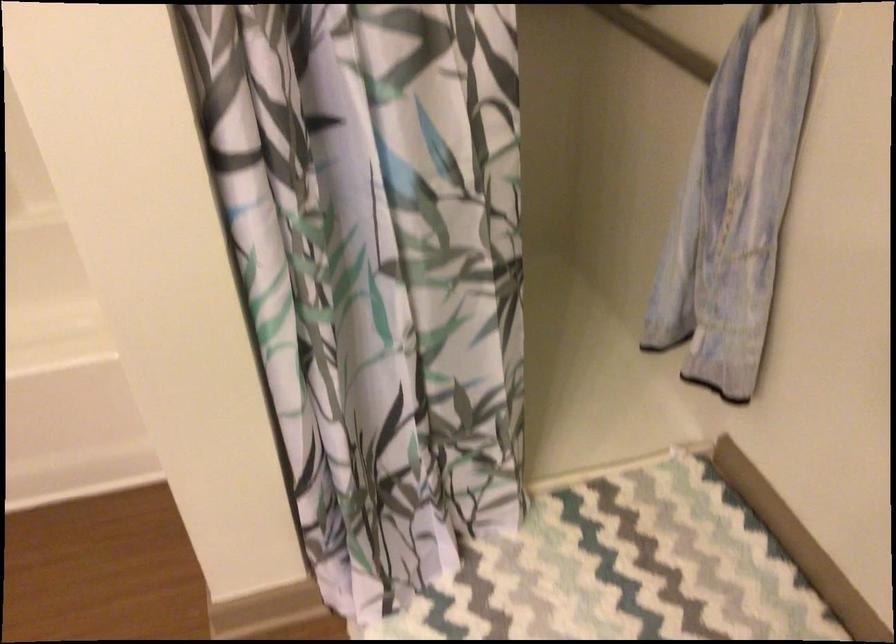
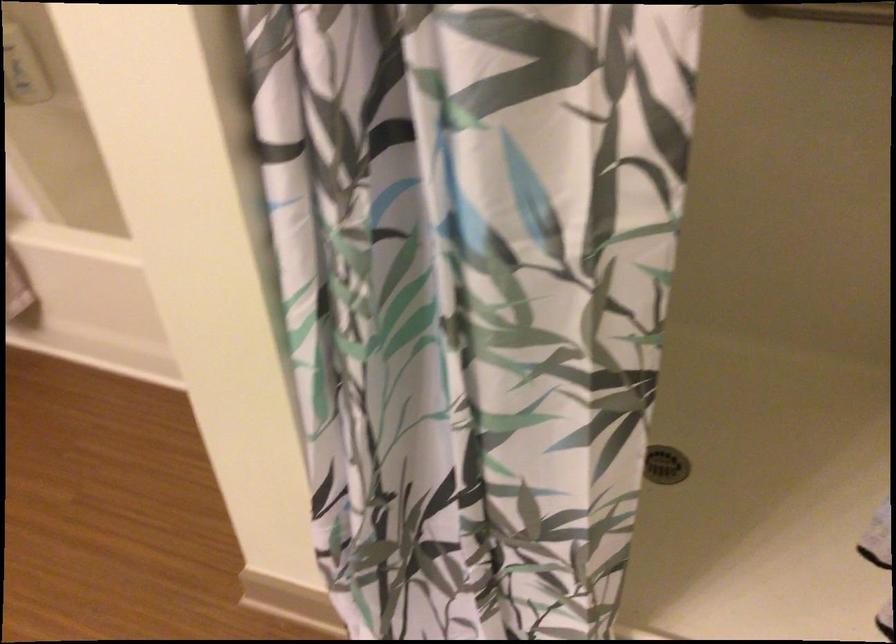
Question: The camera is either moving clockwise (left) or counter-clockwise (right) around the object. The first image is from the beginning of the video and the second image is from the end. Is the camera moving left or right when shooting the video?

Choices:
 (A) Left
 (B) Right

Answer: (B)